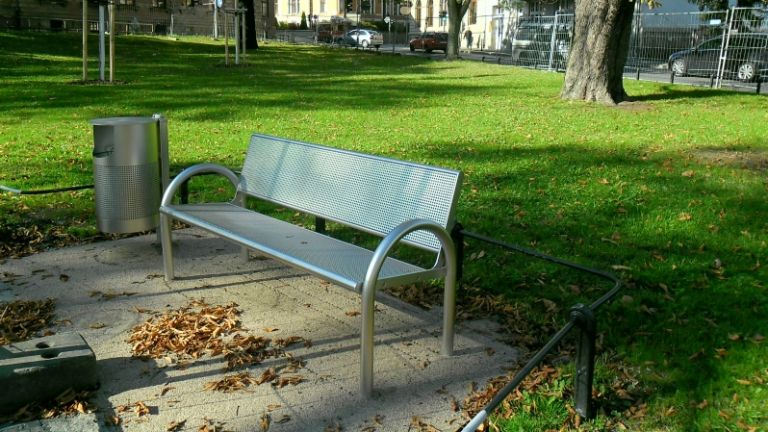
Where is `trash can`? This screenshot has width=768, height=432. trash can is located at coordinates pos(140,163).